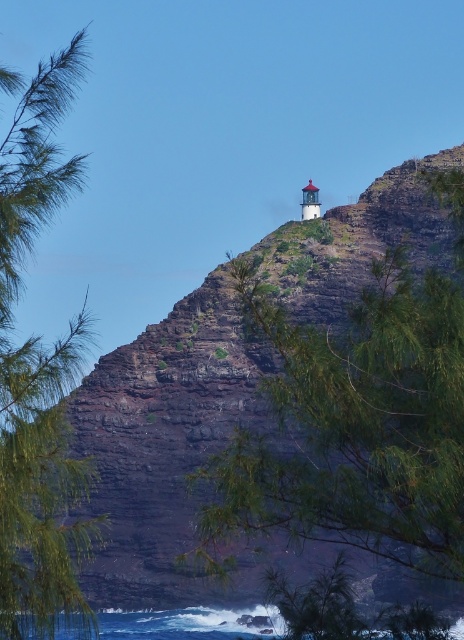
Question: Does green leafy tree at center appear on the left side of blue water at lower center?

Choices:
 (A) no
 (B) yes

Answer: (A)

Question: Which point is farther to the camera?

Choices:
 (A) green leafy tree at center
 (B) blue water at lower center
 (C) green leafy tree at left

Answer: (B)

Question: Which object is the closest to the green leafy tree at center?

Choices:
 (A) blue water at lower center
 (B) green leafy tree at left

Answer: (A)

Question: Is green leafy tree at left in front of blue water at lower center?

Choices:
 (A) yes
 (B) no

Answer: (A)

Question: Does green leafy tree at left appear on the left side of blue water at lower center?

Choices:
 (A) yes
 (B) no

Answer: (A)

Question: Which object is farther from the camera taking this photo?

Choices:
 (A) green leafy tree at left
 (B) green leafy tree at center

Answer: (A)